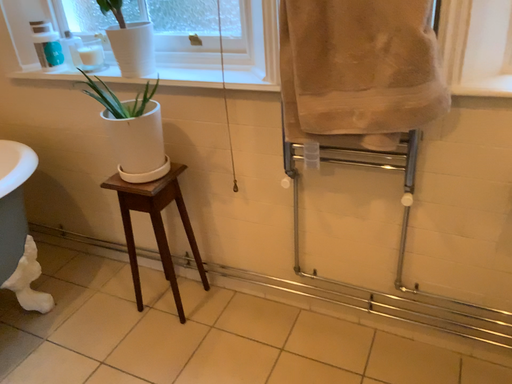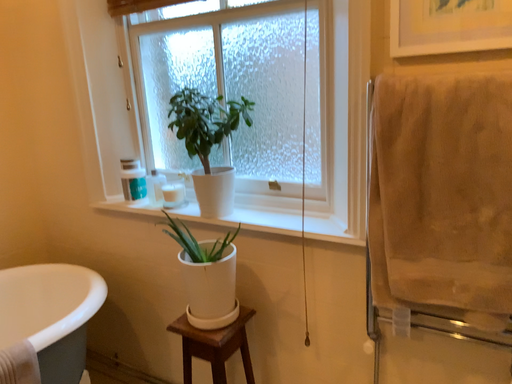
Question: Which way did the camera rotate in the video?

Choices:
 (A) rotated downward
 (B) rotated upward

Answer: (B)